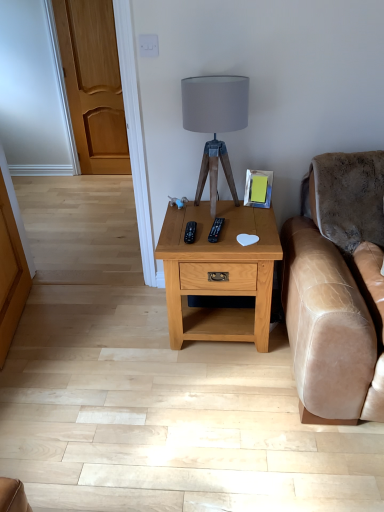
Identify the location of free point to the right of black plastic remote at center, the 2th remote from the left. This screenshot has width=384, height=512. (248, 223).